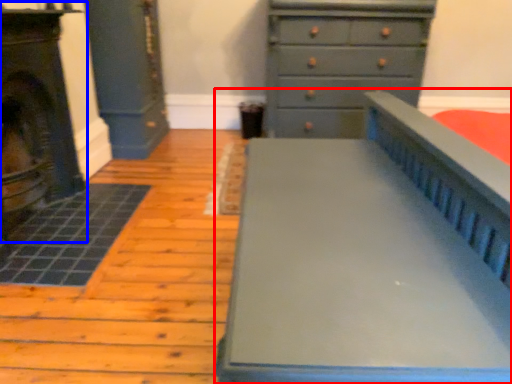
Question: Which of the following is the closest to the observer, furniture (highlighted by a red box) or fireplace (highlighted by a blue box)?

Choices:
 (A) furniture
 (B) fireplace

Answer: (A)